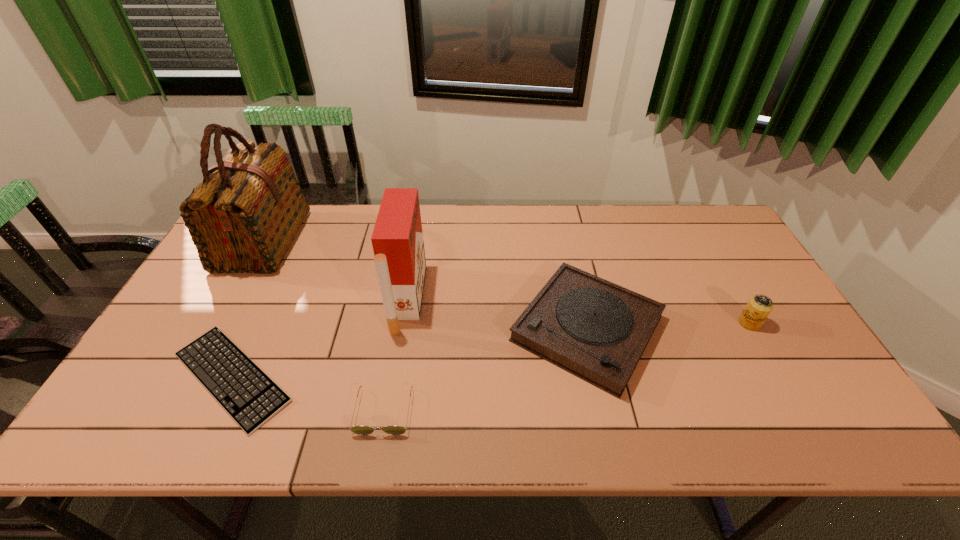
Locate an element on the screen. This screenshot has height=540, width=960. object located in the near left corner section of the desktop is located at coordinates (250, 397).

In the image, there is a desktop. At what (x,y) coordinates should I click in order to perform the action: click on vacant area at the far edge. Please return your answer as a coordinate pair (x, y). The height and width of the screenshot is (540, 960). Looking at the image, I should click on (634, 229).

I want to click on free spot at the near edge of the desktop, so click(x=225, y=412).

Image resolution: width=960 pixels, height=540 pixels. Find the location of `blank space at the left edge`. blank space at the left edge is located at coordinates (189, 392).

In the image, there is a desktop. At what (x,y) coordinates should I click in order to perform the action: click on vacant space at the right edge. Please return your answer as a coordinate pair (x, y). This screenshot has width=960, height=540. Looking at the image, I should click on (797, 384).

Where is `free space at the far right corner of the desktop`? free space at the far right corner of the desktop is located at coordinates (696, 238).

At what (x,y) coordinates should I click in order to perform the action: click on free point between the cigarette case and the computer keyboard. Please return your answer as a coordinate pair (x, y). Looking at the image, I should click on (320, 338).

The height and width of the screenshot is (540, 960). What are the coordinates of `vacant space that is in between the second tallest object and the shortest object` in the screenshot? It's located at (320, 338).

Locate an element on the screen. Image resolution: width=960 pixels, height=540 pixels. unoccupied area between the sunglasses and the shopping bag is located at coordinates (324, 326).

Where is `free space between the sunglasses and the computer keyboard`? The height and width of the screenshot is (540, 960). free space between the sunglasses and the computer keyboard is located at coordinates (308, 394).